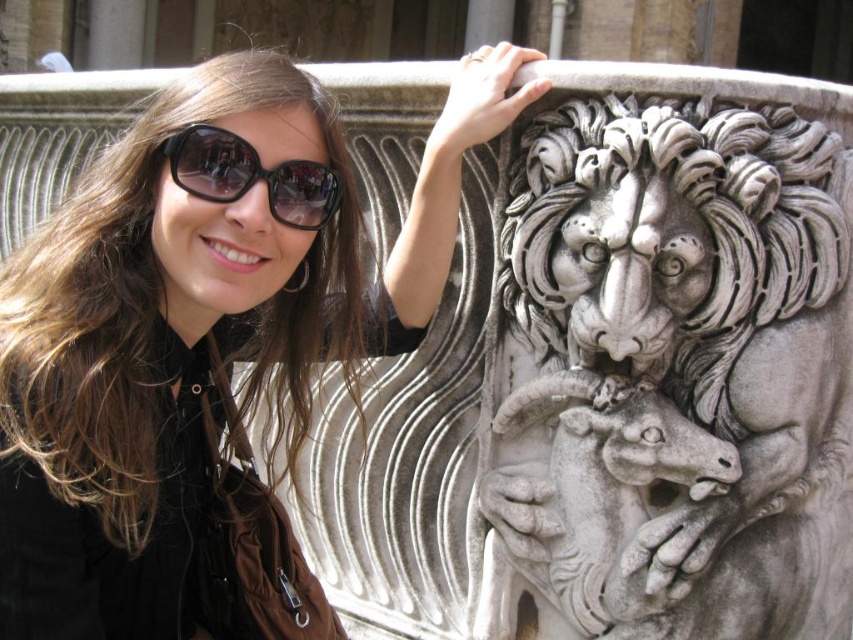
Question: Does white marble lion at upper center have a lesser width compared to black glossy sunglasses at upper center?

Choices:
 (A) no
 (B) yes

Answer: (A)

Question: Which object is closer to the camera taking this photo?

Choices:
 (A) matte black jacket at upper left
 (B) white marble lion at upper center

Answer: (A)

Question: Among these points, which one is nearest to the camera?

Choices:
 (A) (12, 500)
 (B) (326, 168)

Answer: (A)

Question: Does white marble lion at upper center appear under black glossy sunglasses at upper center?

Choices:
 (A) no
 (B) yes

Answer: (B)

Question: Which point appears closest to the camera in this image?

Choices:
 (A) (605, 305)
 (B) (260, 170)

Answer: (B)

Question: Is the position of matte black jacket at upper left less distant than that of black glossy sunglasses at upper center?

Choices:
 (A) no
 (B) yes

Answer: (B)